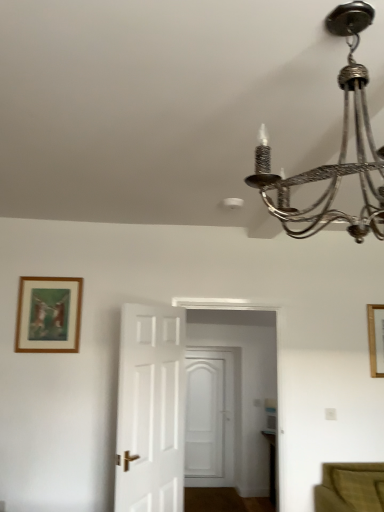
This screenshot has width=384, height=512. What do you see at coordinates (340, 149) in the screenshot?
I see `metallic chandelier at upper right` at bounding box center [340, 149].

Locate an element on the screen. This screenshot has width=384, height=512. metallic chandelier at upper right is located at coordinates (340, 149).

Find the location of a particular element. wooden picture frame at upper right, which ranks as the 1th picture frame in back-to-front order is located at coordinates (376, 339).

At what (x,y) coordinates should I click in order to perform the action: click on white wooden door at center, marked as the 1th door in a back-to-front arrangement. Please return your answer as a coordinate pair (x, y). Looking at the image, I should click on (209, 419).

Find the location of a particular element. Image resolution: width=384 pixels, height=512 pixels. metallic chandelier at upper right is located at coordinates 340,149.

In the scene shown: From the image's perspective, is white wooden door at center, the 2th door in the back-to-front sequence, over wooden picture frame at upper right, which ranks as the 1th picture frame in back-to-front order?

Actually, white wooden door at center, the 2th door in the back-to-front sequence, appears below wooden picture frame at upper right, which ranks as the 1th picture frame in back-to-front order, in the image.

Who is taller, white wooden door at center, the 2th door in the back-to-front sequence, or wooden picture frame at upper right, which is counted as the second picture frame, starting from the left?

white wooden door at center, the 2th door in the back-to-front sequence.

Is white wooden door at center, which appears as the first door when viewed from the front, completely or partially outside of wooden picture frame at upper right, the 2th picture frame when ordered from front to back?

Yes, white wooden door at center, which appears as the first door when viewed from the front, is located beyond the bounds of wooden picture frame at upper right, the 2th picture frame when ordered from front to back.

Could you tell me if white wooden door at center, the 2th door in the back-to-front sequence, is facing wooden picture frame at upper right, which is counted as the second picture frame, starting from the left?

No, white wooden door at center, the 2th door in the back-to-front sequence, is not turned towards wooden picture frame at upper right, which is counted as the second picture frame, starting from the left.

From a real-world perspective, is brown wooden picture frame at upper left, which is the 2th picture frame in right-to-left order, located beneath metallic chandelier at upper right?

Indeed, from a real-world perspective, brown wooden picture frame at upper left, which is the 2th picture frame in right-to-left order, is positioned beneath metallic chandelier at upper right.

Is point (53, 301) more distant than point (264, 147)?

Yes.

From the picture: Considering the sizes of objects brown wooden picture frame at upper left, which ranks as the second picture frame in back-to-front order, and metallic chandelier at upper right in the image provided, who is bigger, brown wooden picture frame at upper left, which ranks as the second picture frame in back-to-front order, or metallic chandelier at upper right?

metallic chandelier at upper right.

Is brown wooden picture frame at upper left, which ranks as the second picture frame in back-to-front order, oriented away from metallic chandelier at upper right?

brown wooden picture frame at upper left, which ranks as the second picture frame in back-to-front order, does not have its back to metallic chandelier at upper right.

Considering the sizes of objects wooden picture frame at upper right, which is counted as the second picture frame, starting from the left, and white wooden door at center, the second door from the right, in the image provided, who is taller, wooden picture frame at upper right, which is counted as the second picture frame, starting from the left, or white wooden door at center, the second door from the right,?

white wooden door at center, the second door from the right.

Which object is further away from the camera, wooden picture frame at upper right, which is counted as the second picture frame, starting from the left, or white wooden door at center, the second door from the right?

wooden picture frame at upper right, which is counted as the second picture frame, starting from the left, is further from the camera.

Can you confirm if wooden picture frame at upper right, the 2th picture frame when ordered from front to back, is thinner than white wooden door at center, the 2th door in the back-to-front sequence?

Yes, wooden picture frame at upper right, the 2th picture frame when ordered from front to back, is thinner than white wooden door at center, the 2th door in the back-to-front sequence.

Which is less distant, (200, 432) or (370, 311)?

The point (370, 311) is closer.

From the image's perspective, is white wooden door at center, marked as the 2th door in a front-to-back arrangement, below wooden picture frame at upper right, which ranks as the 1th picture frame in right-to-left order?

Yes, from the image's perspective, white wooden door at center, marked as the 2th door in a front-to-back arrangement, is below wooden picture frame at upper right, which ranks as the 1th picture frame in right-to-left order.

Is white wooden door at center, marked as the 2th door in a front-to-back arrangement, far from wooden picture frame at upper right, which ranks as the 1th picture frame in right-to-left order?

Absolutely, white wooden door at center, marked as the 2th door in a front-to-back arrangement, is distant from wooden picture frame at upper right, which ranks as the 1th picture frame in right-to-left order.

Is the depth of white wooden door at center, marked as the 1th door in a back-to-front arrangement, greater than that of wooden picture frame at upper right, the 2th picture frame when ordered from front to back?

Yes, it is behind wooden picture frame at upper right, the 2th picture frame when ordered from front to back.

From a real-world perspective, is white wooden door at center, marked as the 1th door in a back-to-front arrangement, on metallic chandelier at upper right?

Incorrect, from a real-world perspective, white wooden door at center, marked as the 1th door in a back-to-front arrangement, is lower than metallic chandelier at upper right.

Who is more distant, white wooden door at center, marked as the 2th door in a front-to-back arrangement, or metallic chandelier at upper right?

Positioned behind is white wooden door at center, marked as the 2th door in a front-to-back arrangement.

Is white wooden door at center, the first door when ordered from right to left, not close to metallic chandelier at upper right?

Yes, white wooden door at center, the first door when ordered from right to left, and metallic chandelier at upper right are located far from each other.

Looking at this image, from the image's perspective, between white wooden door at center, marked as the 1th door in a back-to-front arrangement, and metallic chandelier at upper right, which one is located above?

metallic chandelier at upper right.

Between wooden picture frame at upper right, which ranks as the 1th picture frame in back-to-front order, and brown wooden picture frame at upper left, which ranks as the second picture frame in back-to-front order, which one is positioned in front?

Positioned in front is brown wooden picture frame at upper left, which ranks as the second picture frame in back-to-front order.

From the picture: Does wooden picture frame at upper right, which is counted as the second picture frame, starting from the left, have a larger size compared to brown wooden picture frame at upper left, arranged as the 1th picture frame when viewed from the left?

No.

Is wooden picture frame at upper right, the 2th picture frame when ordered from front to back, facing towards brown wooden picture frame at upper left, which is the 1th picture frame in front-to-back order?

No.

Consider the image. Measure the distance from wooden picture frame at upper right, which ranks as the 1th picture frame in right-to-left order, to brown wooden picture frame at upper left, arranged as the 1th picture frame when viewed from the left.

wooden picture frame at upper right, which ranks as the 1th picture frame in right-to-left order, and brown wooden picture frame at upper left, arranged as the 1th picture frame when viewed from the left, are 2.41 meters apart.

Are brown wooden picture frame at upper left, which ranks as the second picture frame in back-to-front order, and wooden picture frame at upper right, which ranks as the 1th picture frame in back-to-front order, far apart?

Yes, brown wooden picture frame at upper left, which ranks as the second picture frame in back-to-front order, is far from wooden picture frame at upper right, which ranks as the 1th picture frame in back-to-front order.

From a real-world perspective, relative to wooden picture frame at upper right, which is counted as the second picture frame, starting from the left, is brown wooden picture frame at upper left, which is the 1th picture frame in front-to-back order, vertically above or below?

Clearly, from a real-world perspective, brown wooden picture frame at upper left, which is the 1th picture frame in front-to-back order, is above wooden picture frame at upper right, which is counted as the second picture frame, starting from the left.

Does brown wooden picture frame at upper left, which is the 1th picture frame in front-to-back order, have a lesser height compared to wooden picture frame at upper right, which ranks as the 1th picture frame in back-to-front order?

Incorrect, the height of brown wooden picture frame at upper left, which is the 1th picture frame in front-to-back order, does not fall short of that of wooden picture frame at upper right, which ranks as the 1th picture frame in back-to-front order.

Locate an element on the screen. The width and height of the screenshot is (384, 512). picture frame directly beneath the brown wooden picture frame at upper left, which is the 2th picture frame in right-to-left order (from a real-world perspective) is located at coordinates (376, 339).

The width and height of the screenshot is (384, 512). I want to click on the 2nd picture frame behind when counting from the white wooden door at center, which appears as the first door when viewed from the front, so click(376, 339).

Find the location of a particular element. picture frame on the left of metallic chandelier at upper right is located at coordinates (49, 314).

Looking at this image, considering their positions, is white wooden door at center, which appears as the first door when viewed from the front, positioned closer to wooden picture frame at upper right, which ranks as the 1th picture frame in right-to-left order, than white wooden door at center, marked as the 2th door in a front-to-back arrangement?

white wooden door at center, which appears as the first door when viewed from the front, lies closer to wooden picture frame at upper right, which ranks as the 1th picture frame in right-to-left order, than the other object.

From the image, which object appears to be farther from brown wooden picture frame at upper left, which is the 1th picture frame in front-to-back order, white wooden door at center, marked as the 2th door in a front-to-back arrangement, or white wooden door at center, which appears as the first door when viewed from the front?

white wooden door at center, marked as the 2th door in a front-to-back arrangement.

Based on their spatial positions, is wooden picture frame at upper right, the 2th picture frame when ordered from front to back, or white wooden door at center, which appears as the first door when viewed from the front, closer to metallic chandelier at upper right?

white wooden door at center, which appears as the first door when viewed from the front, is closer to metallic chandelier at upper right.

Considering their positions, is brown wooden picture frame at upper left, which is the 1th picture frame in front-to-back order, positioned closer to white wooden door at center, marked as the 2th door in a front-to-back arrangement, than metallic chandelier at upper right?

The object closer to white wooden door at center, marked as the 2th door in a front-to-back arrangement, is brown wooden picture frame at upper left, which is the 1th picture frame in front-to-back order.

From the image, which object appears to be farther from metallic chandelier at upper right, white wooden door at center, which appears as the first door when viewed from the front, or white wooden door at center, marked as the 1th door in a back-to-front arrangement?

Among the two, white wooden door at center, marked as the 1th door in a back-to-front arrangement, is located further to metallic chandelier at upper right.

Which object lies further to the anchor point white wooden door at center, marked as the 1th door in a back-to-front arrangement, brown wooden picture frame at upper left, arranged as the 1th picture frame when viewed from the left, or white wooden door at center, which is the first door in left-to-right order?

brown wooden picture frame at upper left, arranged as the 1th picture frame when viewed from the left, is positioned further to the anchor white wooden door at center, marked as the 1th door in a back-to-front arrangement.

Estimate the real-world distances between objects in this image. Which object is further from white wooden door at center, the 2th door in the back-to-front sequence, brown wooden picture frame at upper left, which is the 1th picture frame in front-to-back order, or wooden picture frame at upper right, which ranks as the 1th picture frame in right-to-left order?

wooden picture frame at upper right, which ranks as the 1th picture frame in right-to-left order, lies further to white wooden door at center, the 2th door in the back-to-front sequence, than the other object.

When comparing their distances from brown wooden picture frame at upper left, arranged as the 1th picture frame when viewed from the left, does wooden picture frame at upper right, which ranks as the 1th picture frame in back-to-front order, or white wooden door at center, which appears as the 2th door when viewed from the left, seem closer?

wooden picture frame at upper right, which ranks as the 1th picture frame in back-to-front order, is positioned closer to the anchor brown wooden picture frame at upper left, arranged as the 1th picture frame when viewed from the left.

I want to click on door between metallic chandelier at upper right and brown wooden picture frame at upper left, which is the 2th picture frame in right-to-left order, in the front-back direction, so click(x=151, y=410).

You are a GUI agent. You are given a task and a screenshot of the screen. Output one action in this format:
    pyautogui.click(x=<x>, y=<y>)
    Task: Click on the door between metallic chandelier at upper right and wooden picture frame at upper right, which ranks as the 1th picture frame in right-to-left order, from front to back
    
    Given the screenshot: What is the action you would take?
    pyautogui.click(x=151, y=410)

You are a GUI agent. You are given a task and a screenshot of the screen. Output one action in this format:
    pyautogui.click(x=<x>, y=<y>)
    Task: Click on the door between metallic chandelier at upper right and white wooden door at center, which appears as the 2th door when viewed from the left, from front to back
    The image size is (384, 512).
    Given the screenshot: What is the action you would take?
    pyautogui.click(x=151, y=410)

You are a GUI agent. You are given a task and a screenshot of the screen. Output one action in this format:
    pyautogui.click(x=<x>, y=<y>)
    Task: Click on the picture frame between metallic chandelier at upper right and wooden picture frame at upper right, which ranks as the 1th picture frame in right-to-left order, from front to back
    The image size is (384, 512).
    Given the screenshot: What is the action you would take?
    pyautogui.click(x=49, y=314)